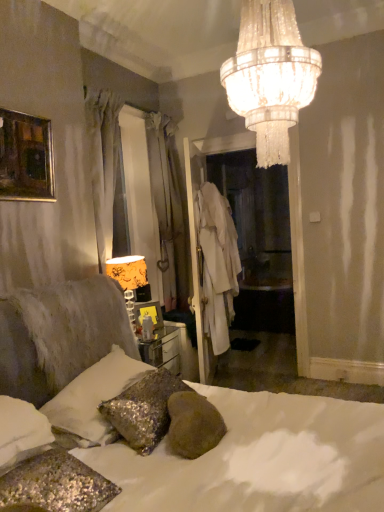
Question: Does point (91, 390) appear closer or farther from the camera than point (221, 227)?

Choices:
 (A) closer
 (B) farther

Answer: (A)

Question: From the image's perspective, is sparkly silver pillow at lower left, the second pillow positioned from the back, located above or below white cotton robe at center?

Choices:
 (A) below
 (B) above

Answer: (A)

Question: Which is farther from the white cotton robe at center?

Choices:
 (A) white sequined pillow at lower left, which ranks as the 3th pillow in front-to-back order
 (B) white fabric coat at center
 (C) crystal chandelier at upper center
 (D) orange fabric lampshade at left
 (E) metallic silver picture frame at center, the second picture frame from the left

Answer: (C)

Question: Estimate the real-world distances between objects in this image. Which object is closer to the sparkly silver pillow at lower left, which is the 2th pillow from front to back?

Choices:
 (A) gold-framed painting at upper left, positioned as the second picture frame in back-to-front order
 (B) white cotton robe at center
 (C) white sequined pillow at lower left, which ranks as the 3th pillow in front-to-back order
 (D) orange fabric lampshade at left
 (E) metallic silver picture frame at center, marked as the first picture frame in a back-to-front arrangement

Answer: (C)